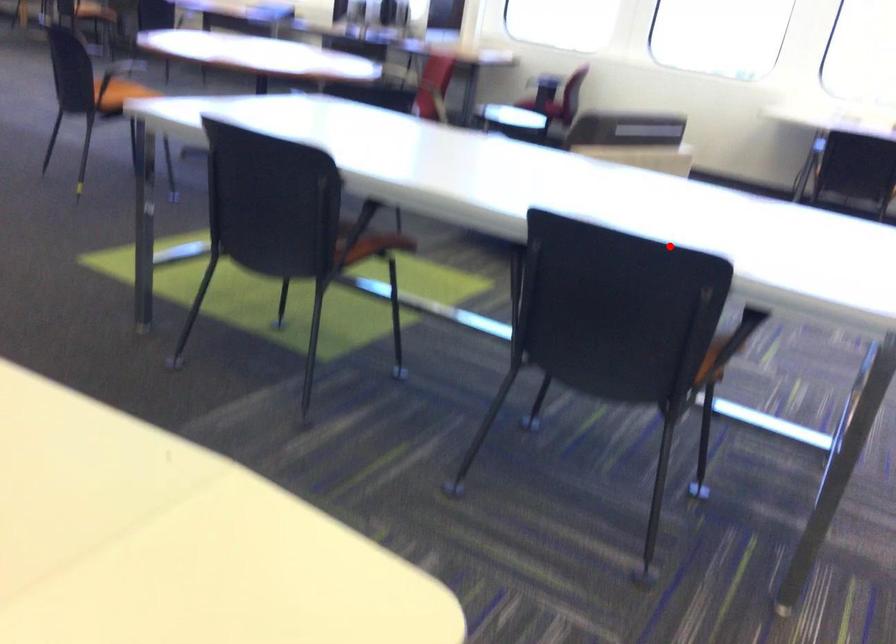
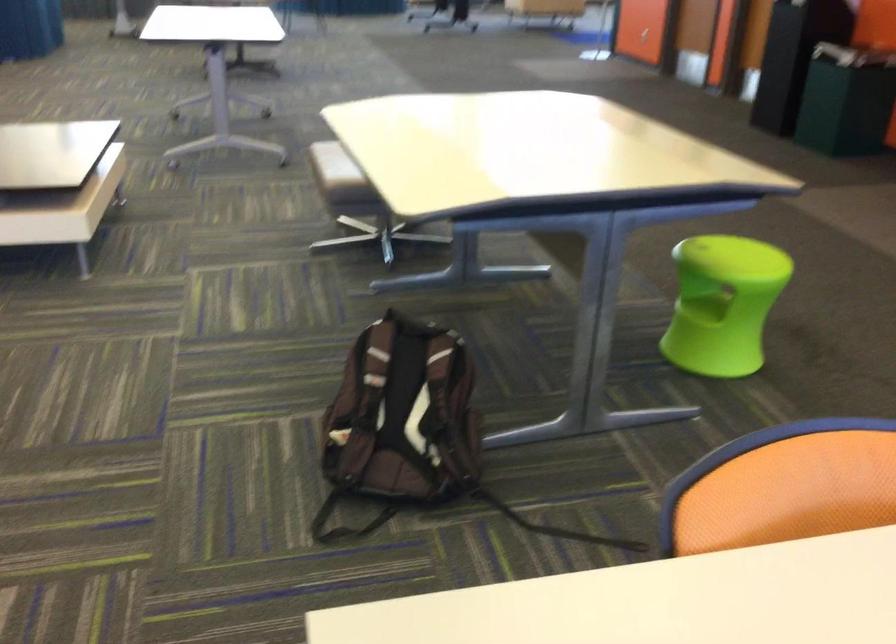
Question: I am providing you with two images of the same scene from different viewpoints. In image1, a red point is highlighted. Considering the same 3D point in image2, which of the following is correct?

Choices:
 (A) It is closer
 (B) It is farther

Answer: (A)